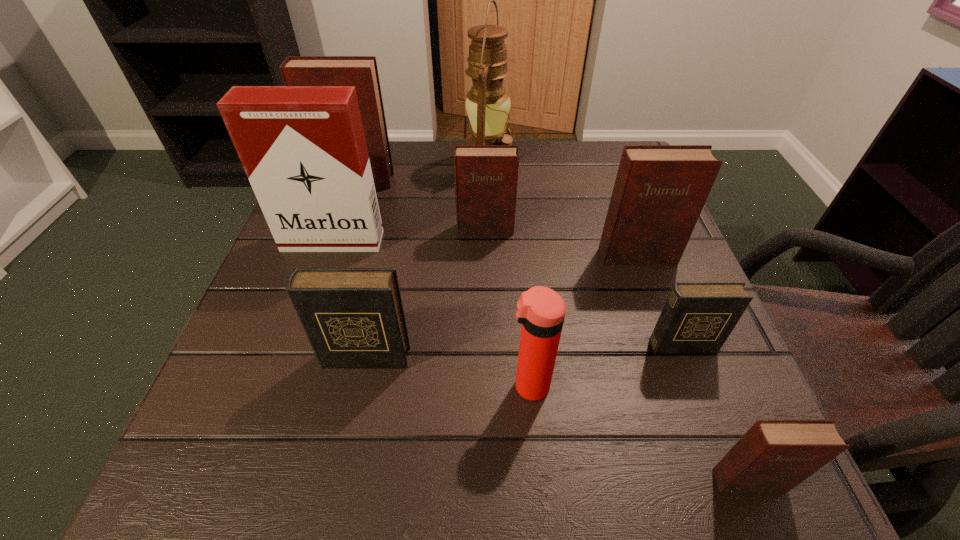
Choose which object is the eighth nearest neighbor to the eighth farthest object. Please provide its 2D coordinates. Your answer should be formatted as a tuple, i.e. [(x, y)], where the tuple contains the x and y coordinates of a point satisfying the conditions above.

[(360, 71)]

This screenshot has width=960, height=540. Find the location of `the eighth closest object to the leftmost reddish-brown diary`. the eighth closest object to the leftmost reddish-brown diary is located at coordinates (773, 455).

What are the coordinates of `diary that is the closest one to the oil lamp` in the screenshot? It's located at (486, 176).

Identify which diary is located as the second nearest to the eighth farthest object. Please provide its 2D coordinates. Your answer should be formatted as a tuple, i.e. [(x, y)], where the tuple contains the x and y coordinates of a point satisfying the conditions above.

[(698, 317)]

Locate an element on the screen. reddish-brown diary that is the second closest to the thermos bottle is located at coordinates (660, 190).

Where is `reddish-brown diary identified as the second closest to the left dark diary`? reddish-brown diary identified as the second closest to the left dark diary is located at coordinates (660, 190).

Locate an element on the screen. The image size is (960, 540). free location that satisfies the following two spatial constraints: 1. on the front cover of the second nearest object; 2. on the left side of the farthest reddish-brown diary is located at coordinates (284, 386).

Where is `free spot that satisfies the following two spatial constraints: 1. on the front cover of the tallest diary; 2. on the left side of the thermos bottle`? Image resolution: width=960 pixels, height=540 pixels. free spot that satisfies the following two spatial constraints: 1. on the front cover of the tallest diary; 2. on the left side of the thermos bottle is located at coordinates coord(284,386).